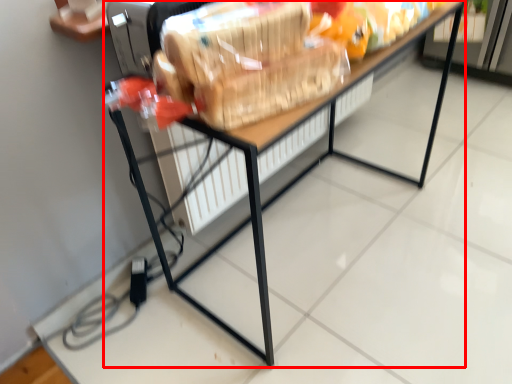
Question: Observing the image, what is the correct spatial positioning of table (annotated by the red box) in reference to stuff?

Choices:
 (A) left
 (B) right

Answer: (B)